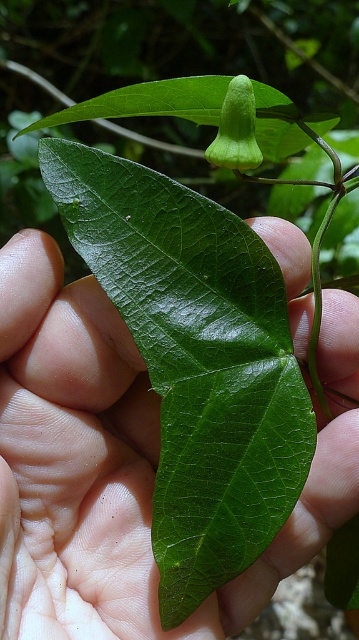
You are a botanist examining a plant through a camera lens. You notice two features in the image, the green glossy leaf at center and the green matte flower at upper center. Which of these two features is nearer to your lens?

The green glossy leaf at center is closer to the viewer than the green matte flower at upper center, so the green glossy leaf at center is nearer to your lens.

You are a botanist examining a plant in a forest. You notice the green glossy leaf at center and the green matte flower at upper center. Which object is wider?

The green glossy leaf at center is wider than the green matte flower at upper center.